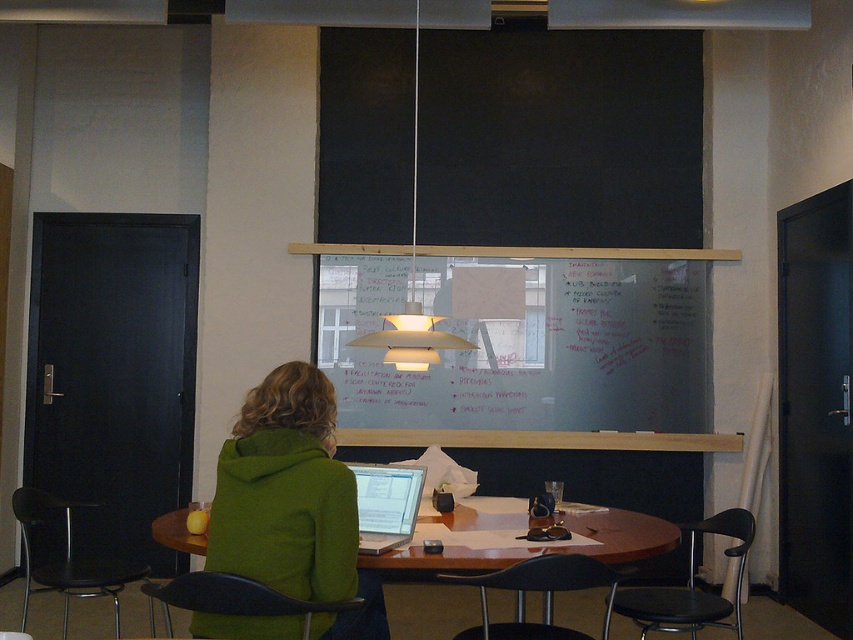
You are standing in the room and want to reach the point marked at coordinates (329, 419). The door is 10 feet away from you. Can you walk directly to the point without passing through the door?

The distance between you and the point marked at coordinates (329, 419) is 9.16 feet, which is less than the 10 feet to the door. Therefore, you can reach the point before reaching the door, so you can walk directly to the point without passing through the door.

You are organizing a meeting in this room and need to ensure there is enough space for a 1.5 meter wide screen behind the wooden table at center. Considering the green hoodie at center is currently on the table, will the screen fit behind the table without overlapping the hoodie?

The green hoodie at center has a lesser width compared to wooden table at center. Since the screen is 1.5 meters wide and the table is wider than the hoodie, the screen can be placed behind the table as long as it aligns with the table edges. The hoodie being narrower won t block the screen placement.

You are organizing a meeting in this room and need to seat two people. You have two black plastic chairs available. The chairs are labeled as black plastic chair at lower right and black plastic chair at lower left. Which chair would be better for a taller person to sit on?

The black plastic chair at lower left would be better for a taller person since it occupies more space than the black plastic chair at lower right.